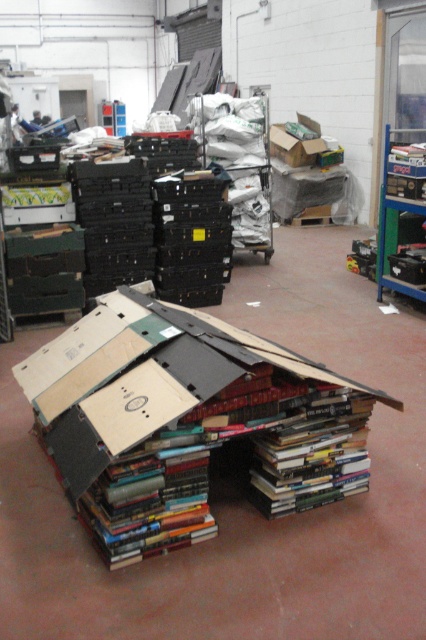
Between point (385, 212) and point (305, 150), which one is positioned in front?

Positioned in front is point (385, 212).

Is the position of metallic blue bookshelf at upper right more distant than that of cardboard box at upper center?

No.

Who is more distant from viewer, (394, 282) or (302, 156)?

The point (302, 156) is more distant.

Locate an element on the screen. metallic blue bookshelf at upper right is located at coordinates [394, 225].